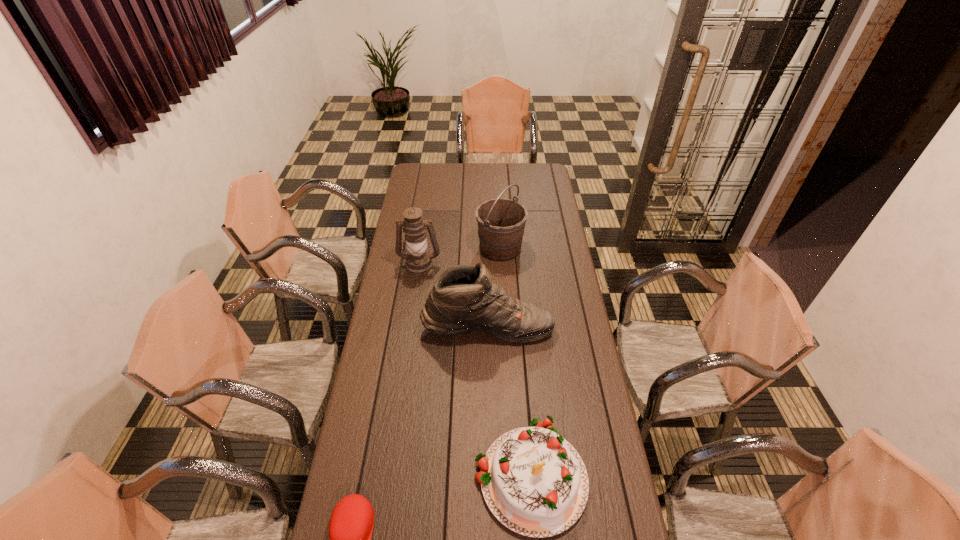
Where is `vacant space that is in between the bucket and the fourth tallest object`? This screenshot has height=540, width=960. vacant space that is in between the bucket and the fourth tallest object is located at coordinates (516, 361).

Locate an element on the screen. This screenshot has width=960, height=540. vacant area between the bucket and the oil lamp is located at coordinates (460, 256).

Identify which object is the fourth closest to the oil lamp. Please provide its 2D coordinates. Your answer should be formatted as a tuple, i.e. [(x, y)], where the tuple contains the x and y coordinates of a point satisfying the conditions above.

[(351, 524)]

You are a GUI agent. You are given a task and a screenshot of the screen. Output one action in this format:
    pyautogui.click(x=<x>, y=<y>)
    Task: Click on the object that is the fourth nearest to the second shortest object
    The width and height of the screenshot is (960, 540).
    Given the screenshot: What is the action you would take?
    pyautogui.click(x=501, y=222)